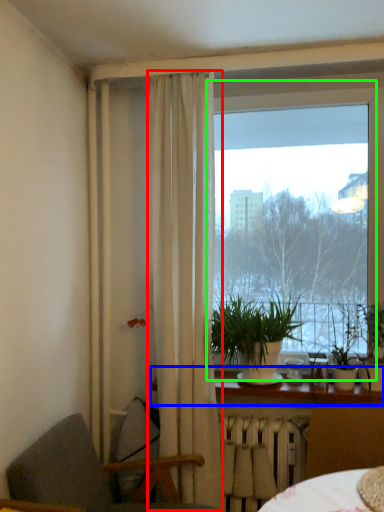
Question: Considering the real-world distances, which object is closest to curtain (highlighted by a red box)? window sill (highlighted by a blue box) or window (highlighted by a green box).

Choices:
 (A) window sill
 (B) window

Answer: (A)